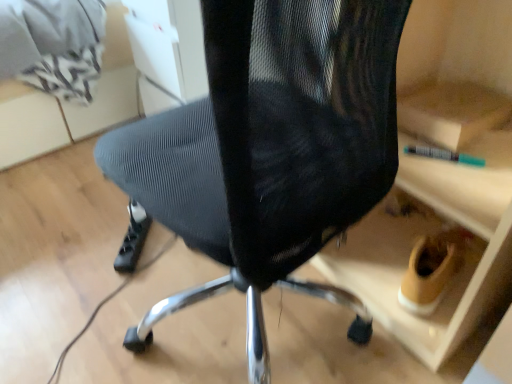
Question: Can you confirm if matte gray mesh chair at upper center is smaller than black mesh chair at center?

Choices:
 (A) yes
 (B) no

Answer: (B)

Question: Is matte gray mesh chair at upper center turned away from black mesh chair at center?

Choices:
 (A) yes
 (B) no

Answer: (B)

Question: Is matte gray mesh chair at upper center to the left of black mesh chair at center from the viewer's perspective?

Choices:
 (A) no
 (B) yes

Answer: (B)

Question: Considering the relative positions of matte gray mesh chair at upper center and black mesh chair at center in the image provided, is matte gray mesh chair at upper center to the right of black mesh chair at center from the viewer's perspective?

Choices:
 (A) yes
 (B) no

Answer: (B)

Question: Is black mesh chair at center surrounded by matte gray mesh chair at upper center?

Choices:
 (A) yes
 (B) no

Answer: (B)

Question: From the image's perspective, does matte gray mesh chair at upper center appear higher than black mesh chair at center?

Choices:
 (A) no
 (B) yes

Answer: (B)

Question: Can we say black plastic power strip at lower left lies outside black mesh chair at center?

Choices:
 (A) no
 (B) yes

Answer: (B)

Question: Is black plastic power strip at lower left smaller than black mesh chair at center?

Choices:
 (A) no
 (B) yes

Answer: (B)

Question: From the image's perspective, is black plastic power strip at lower left under black mesh chair at center?

Choices:
 (A) no
 (B) yes

Answer: (B)

Question: Is black plastic power strip at lower left taller than black mesh chair at center?

Choices:
 (A) no
 (B) yes

Answer: (A)

Question: From the image's perspective, is black plastic power strip at lower left above black mesh chair at center?

Choices:
 (A) no
 (B) yes

Answer: (A)

Question: Considering the relative sizes of black plastic power strip at lower left and black mesh chair at center in the image provided, is black plastic power strip at lower left thinner than black mesh chair at center?

Choices:
 (A) yes
 (B) no

Answer: (A)

Question: Are black mesh chair at center and black plastic power strip at lower left beside each other?

Choices:
 (A) no
 (B) yes

Answer: (A)